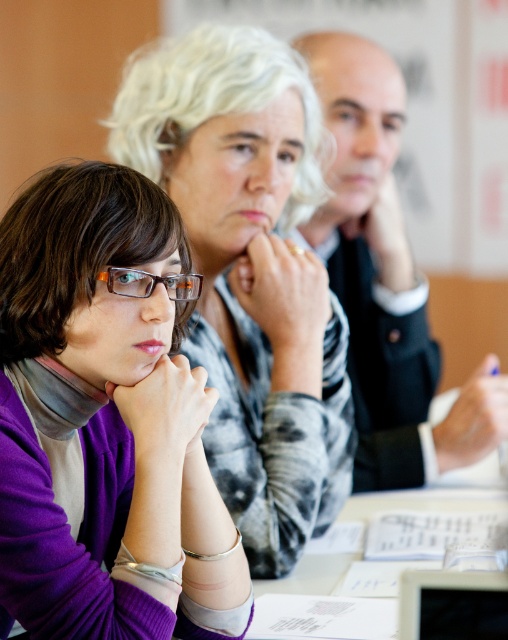
You are organizing a photo shoot and need to arrange two outfits for a catalog. You have a matte gray sweater at center and a smooth black suit at center. Based on their sizes, which outfit would you choose to place on a taller mannequin?

The smooth black suit at center is taller than the matte gray sweater at center, so it should be placed on the taller mannequin.

You are a photographer trying to capture a closeup of the person at point (149,54) and the person at point (396,289). Which person will appear larger in your photo?

The person at point (149,54) will appear larger in the photo because it is closer to the viewer than the person at point (396,289).